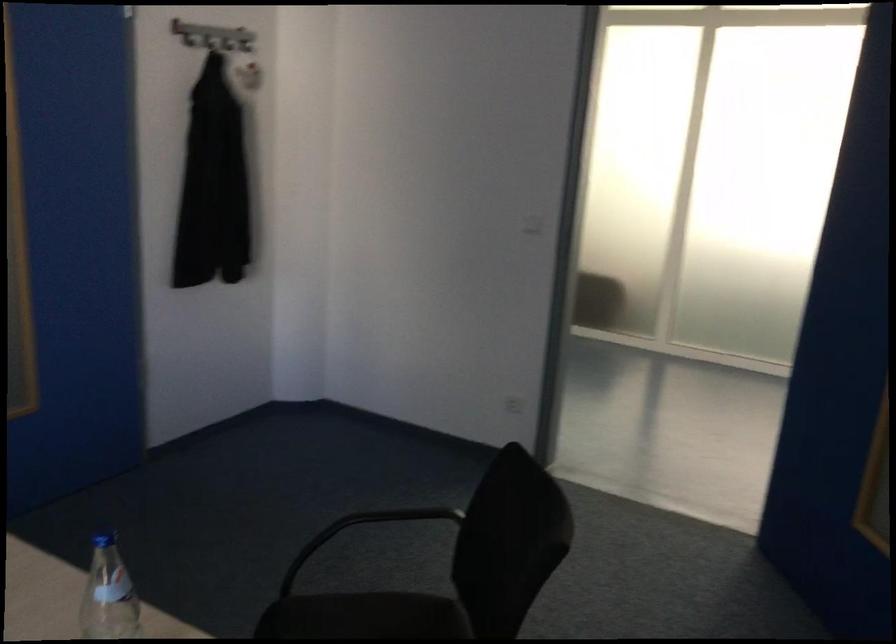
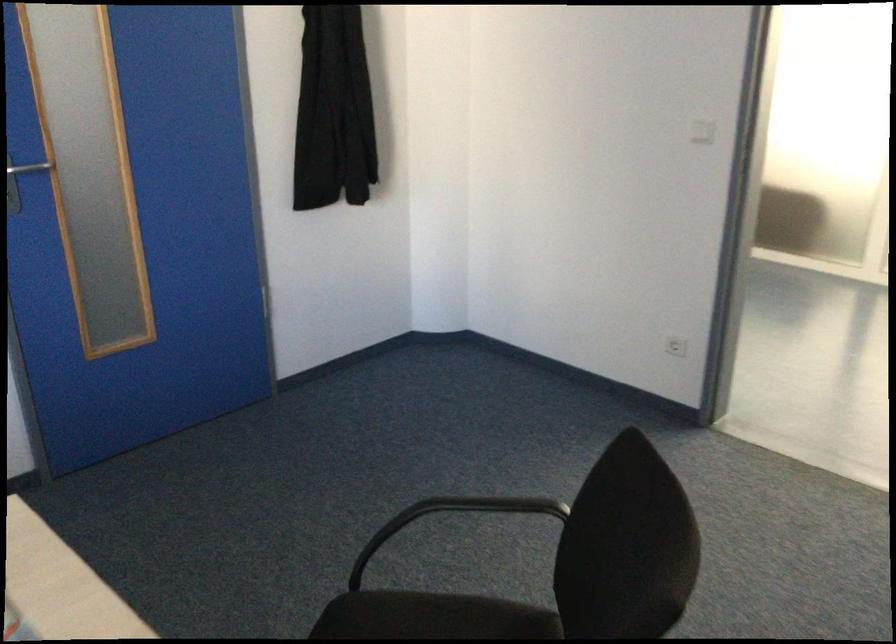
Question: The images are taken continuously from a first-person perspective. In which direction is your viewpoint rotating?

Choices:
 (A) Left
 (B) Right
 (C) Up
 (D) Down

Answer: (A)